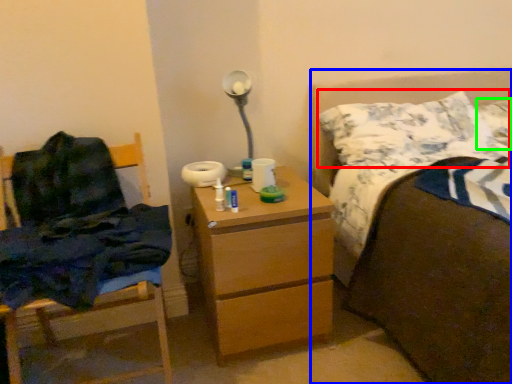
Question: Considering the real-world distances, which object is farthest from pillow (highlighted by a red box)? bed (highlighted by a blue box) or pillow (highlighted by a green box)?

Choices:
 (A) bed
 (B) pillow

Answer: (A)